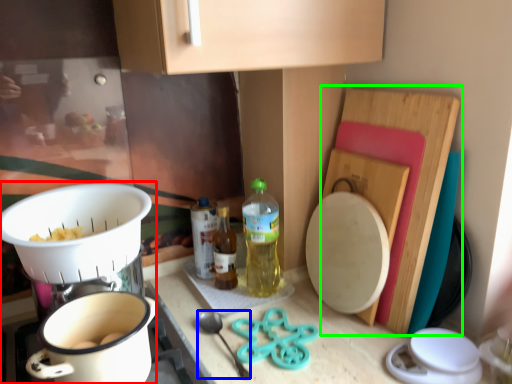
Question: Estimate the real-world distances between objects in this image. Which object is farther from appliance (highlighted by a red box), utensil (highlighted by a blue box) or cutting board (highlighted by a green box)?

Choices:
 (A) utensil
 (B) cutting board

Answer: (B)